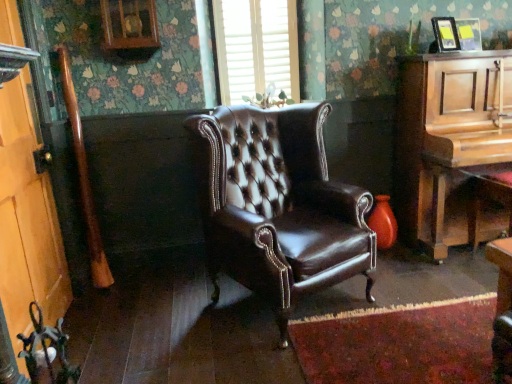
What is the approximate height of wooden door at left?

1.63 meters.

Locate an element on the screen. This screenshot has height=384, width=512. wooden door at left is located at coordinates (27, 219).

You are a GUI agent. You are given a task and a screenshot of the screen. Output one action in this format:
    pyautogui.click(x=<x>, y=<y>)
    Task: Click on the brown leather wingback chair at center
    The width and height of the screenshot is (512, 384).
    Given the screenshot: What is the action you would take?
    pyautogui.click(x=281, y=206)

Identify the location of wooden piano at right. This screenshot has width=512, height=384. (450, 144).

From the image's perspective, between wooden door at left and white textured blinds at upper center, which one is located above?

white textured blinds at upper center is shown above in the image.

Is wooden door at left not within white textured blinds at upper center?

wooden door at left lies outside white textured blinds at upper center's area.

Does wooden door at left have a smaller size compared to white textured blinds at upper center?

Incorrect, wooden door at left is not smaller in size than white textured blinds at upper center.

Which is in front, point (18, 314) or point (255, 84)?

Point (18, 314)

Would you consider brown leather wingback chair at center to be distant from white textured blinds at upper center?

brown leather wingback chair at center is actually quite close to white textured blinds at upper center.

Can you confirm if brown leather wingback chair at center is wider than white textured blinds at upper center?

Correct, the width of brown leather wingback chair at center exceeds that of white textured blinds at upper center.

Is brown leather wingback chair at center taller than white textured blinds at upper center?

Indeed, brown leather wingback chair at center has a greater height compared to white textured blinds at upper center.

Is brown leather wingback chair at center at the left side of white textured blinds at upper center?

No.

Would you say white textured blinds at upper center contains wooden piano at right?

No, wooden piano at right is located outside of white textured blinds at upper center.

Looking at this image, is white textured blinds at upper center bigger or smaller than wooden piano at right?

white textured blinds at upper center is smaller than wooden piano at right.

Which is in front, white textured blinds at upper center or wooden piano at right?

wooden piano at right.

Does white textured blinds at upper center appear on the left side of wooden piano at right?

Yes, white textured blinds at upper center is to the left of wooden piano at right.

Looking at this image, is brown leather wingback chair at center aimed at wooden door at left?

No, brown leather wingback chair at center is not aimed at wooden door at left.

Would you say brown leather wingback chair at center is a long distance from wooden door at left?

Yes, brown leather wingback chair at center and wooden door at left are located far from each other.

From a real-world perspective, which object rests below the other?

From a 3D spatial view, brown leather wingback chair at center is below.

How many degrees apart are the facing directions of brown leather wingback chair at center and wooden piano at right?

The angular difference between brown leather wingback chair at center and wooden piano at right is 29.2 degrees.

Can you confirm if brown leather wingback chair at center is bigger than wooden piano at right?

Actually, brown leather wingback chair at center might be smaller than wooden piano at right.

Is brown leather wingback chair at center aimed at wooden piano at right?

No, brown leather wingback chair at center is not aimed at wooden piano at right.

From the image's perspective, is brown leather wingback chair at center located beneath wooden piano at right?

Yes, from the image's perspective, brown leather wingback chair at center is beneath wooden piano at right.

Who is shorter, wooden door at left or brown leather wingback chair at center?

Standing shorter between the two is brown leather wingback chair at center.

What are the coordinates of `door in front of the brown leather wingback chair at center` in the screenshot? It's located at (27, 219).

Is wooden door at left inside or outside of brown leather wingback chair at center?

wooden door at left lies outside brown leather wingback chair at center.

Is white textured blinds at upper center looking in the opposite direction of brown leather wingback chair at center?

No, white textured blinds at upper center is not facing the opposite direction of brown leather wingback chair at center.

From the image's perspective, is white textured blinds at upper center beneath brown leather wingback chair at center?

No, from the image's perspective, white textured blinds at upper center is not below brown leather wingback chair at center.

Measure the distance from white textured blinds at upper center to brown leather wingback chair at center.

white textured blinds at upper center and brown leather wingback chair at center are 91.21 centimeters apart from each other.

Which object is positioned more to the left, white textured blinds at upper center or brown leather wingback chair at center?

white textured blinds at upper center.

You are a GUI agent. You are given a task and a screenshot of the screen. Output one action in this format:
    pyautogui.click(x=<x>, y=<y>)
    Task: Click on the door in front of the white textured blinds at upper center
    
    Given the screenshot: What is the action you would take?
    pyautogui.click(x=27, y=219)

The image size is (512, 384). In order to click on chair that is below the white textured blinds at upper center (from the image's perspective) in this screenshot , I will do `click(281, 206)`.

Based on their spatial positions, is wooden door at left or wooden piano at right closer to white textured blinds at upper center?

wooden piano at right lies closer to white textured blinds at upper center than the other object.

When comparing their distances from brown leather wingback chair at center, does white textured blinds at upper center or wooden door at left seem closer?

Among the two, white textured blinds at upper center is located nearer to brown leather wingback chair at center.

Estimate the real-world distances between objects in this image. Which object is further from white textured blinds at upper center, wooden piano at right or brown leather wingback chair at center?

wooden piano at right is further to white textured blinds at upper center.

From the image, which object appears to be farther from brown leather wingback chair at center, wooden door at left or wooden piano at right?

Among the two, wooden door at left is located further to brown leather wingback chair at center.

Considering their positions, is brown leather wingback chair at center positioned closer to wooden door at left than wooden piano at right?

Based on the image, brown leather wingback chair at center appears to be nearer to wooden door at left.

When comparing their distances from wooden piano at right, does brown leather wingback chair at center or wooden door at left seem closer?

brown leather wingback chair at center lies closer to wooden piano at right than the other object.

Which object lies nearer to the anchor point wooden piano at right, wooden door at left or white textured blinds at upper center?

Among the two, white textured blinds at upper center is located nearer to wooden piano at right.

Consider the image. From the image, which object appears to be nearer to brown leather wingback chair at center, wooden piano at right or wooden door at left?

wooden piano at right is closer to brown leather wingback chair at center.

The width and height of the screenshot is (512, 384). I want to click on chair between white textured blinds at upper center and wooden piano at right in the horizontal direction, so (281, 206).

Identify the location of chair between wooden door at left and white textured blinds at upper center from front to back. (281, 206).

This screenshot has height=384, width=512. I want to click on window situated between wooden door at left and wooden piano at right from left to right, so click(256, 47).

The width and height of the screenshot is (512, 384). Find the location of `chair situated between wooden door at left and wooden piano at right from left to right`. chair situated between wooden door at left and wooden piano at right from left to right is located at coordinates (281, 206).